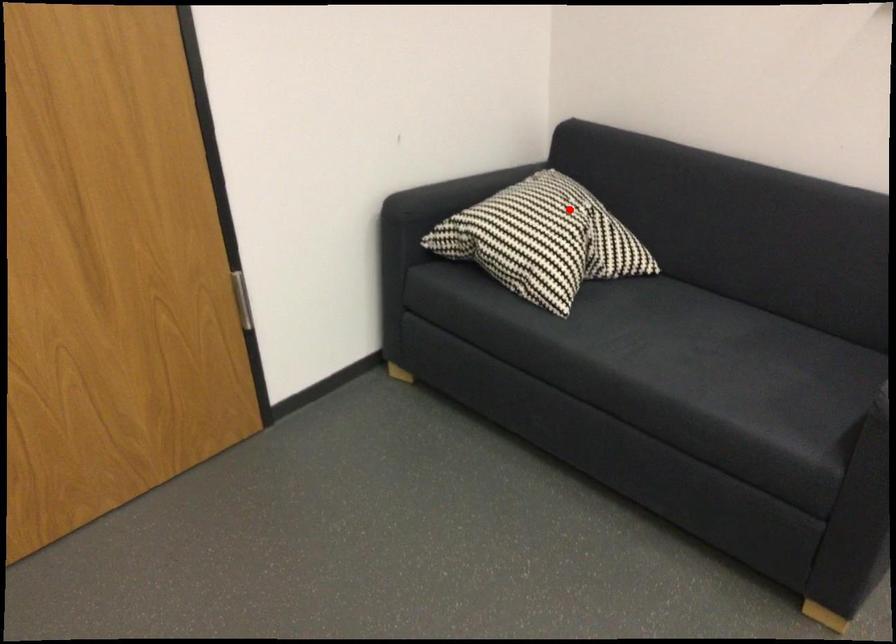
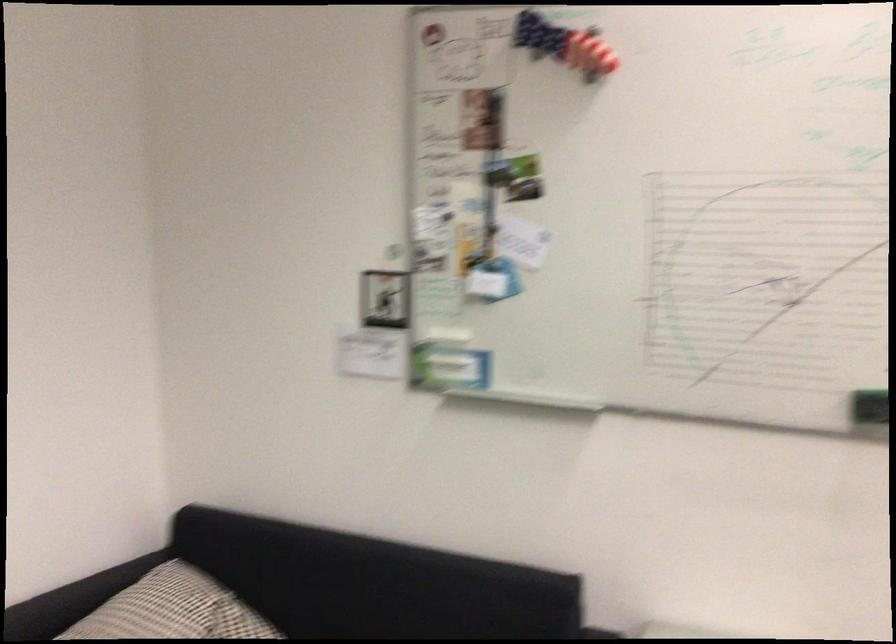
Where in the second image is the point corresponding to the highlighted location from the first image?

(193, 612)